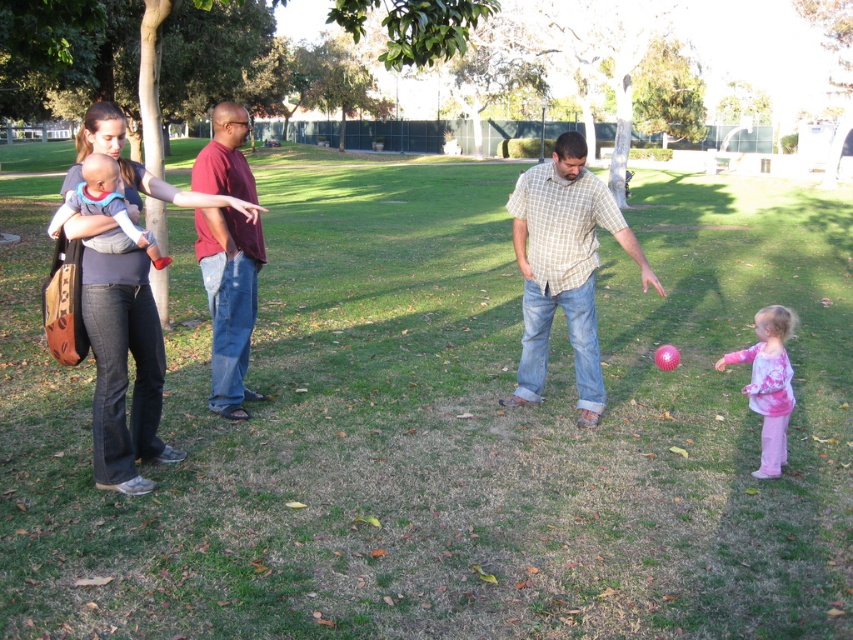
Which is below, checkered shirt jeans at center or matte gray baby at left?

checkered shirt jeans at center is lower down.

Between point (639, 266) and point (99, 168), which one is positioned behind?

The point (639, 266) is more distant.

Find the location of a particular element. checkered shirt jeans at center is located at coordinates (564, 268).

Is maroon t-shirt at center shorter than pink cotton shirt at lower right?

Yes, maroon t-shirt at center is shorter than pink cotton shirt at lower right.

Is maroon t-shirt at center closer to camera compared to pink cotton shirt at lower right?

No, maroon t-shirt at center is behind pink cotton shirt at lower right.

Which is in front, point (218, 305) or point (782, 384)?

Point (782, 384) is in front.

Where is `maroon t-shirt at center`? The image size is (853, 640). maroon t-shirt at center is located at coordinates (229, 300).

Image resolution: width=853 pixels, height=640 pixels. In order to click on matte black shirt at upper left in this screenshot , I will do `click(123, 368)`.

Based on the photo, does matte black shirt at upper left have a greater height compared to maroon t-shirt at center?

Correct, matte black shirt at upper left is much taller as maroon t-shirt at center.

Where is `matte black shirt at upper left`? This screenshot has height=640, width=853. matte black shirt at upper left is located at coordinates (123, 368).